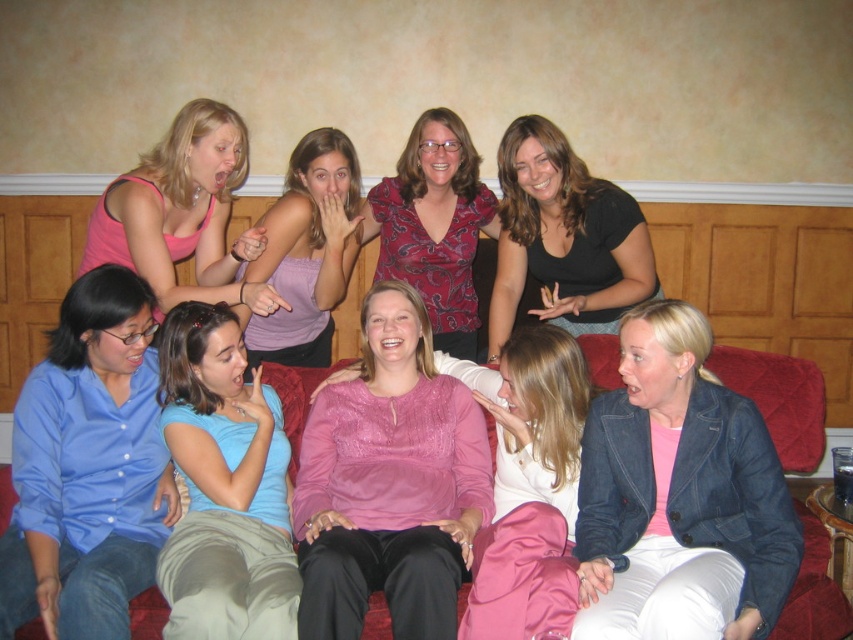
Question: In this image, where is light blue cotton shirt at lower left located relative to pink tank top at upper left?

Choices:
 (A) left
 (B) right

Answer: (B)

Question: Does pink satin blouse at center have a greater width compared to blue button-down shirt at left?

Choices:
 (A) yes
 (B) no

Answer: (A)

Question: Which object is closer to the camera taking this photo?

Choices:
 (A) black matte shirt at center
 (B) light blue cotton shirt at lower left

Answer: (B)

Question: Which is nearer to the matte purple tank top at upper center?

Choices:
 (A) black matte shirt at center
 (B) red fabric couch at lower center

Answer: (A)

Question: Which object is positioned farthest from the satin pink skirt at center?

Choices:
 (A) matte purple tank top at upper center
 (B) pink satin blouse at center
 (C) black matte shirt at center

Answer: (A)

Question: Is black matte shirt at center behind matte purple tank top at upper center?

Choices:
 (A) yes
 (B) no

Answer: (B)